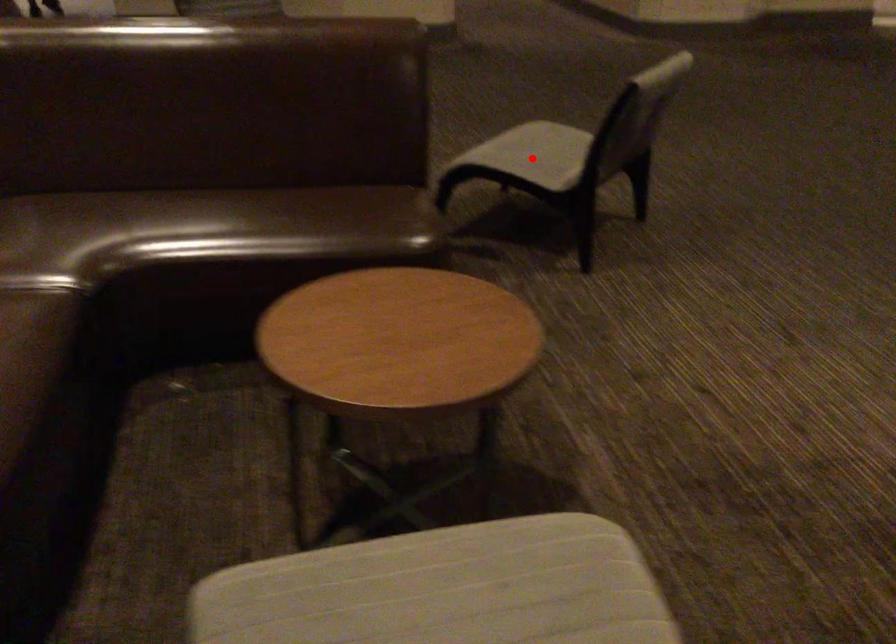
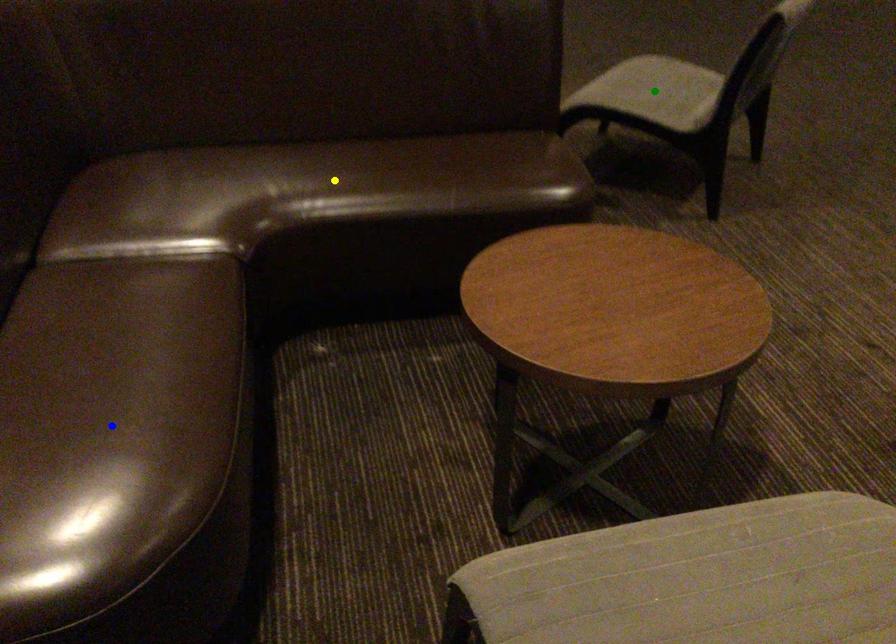
Question: I am providing you with two images of the same scene from different viewpoints. A red point is marked on the first image. You are given multiple points on the second image. Which mark in image 2 goes with the point in image 1?

Choices:
 (A) green point
 (B) blue point
 (C) yellow point

Answer: (A)